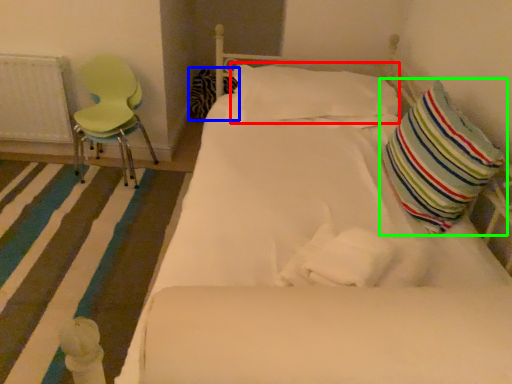
Question: Which object is the closest to the pillow (highlighted by a red box)? Choose among these: pillow (highlighted by a blue box) or pillow (highlighted by a green box).

Choices:
 (A) pillow
 (B) pillow

Answer: (B)